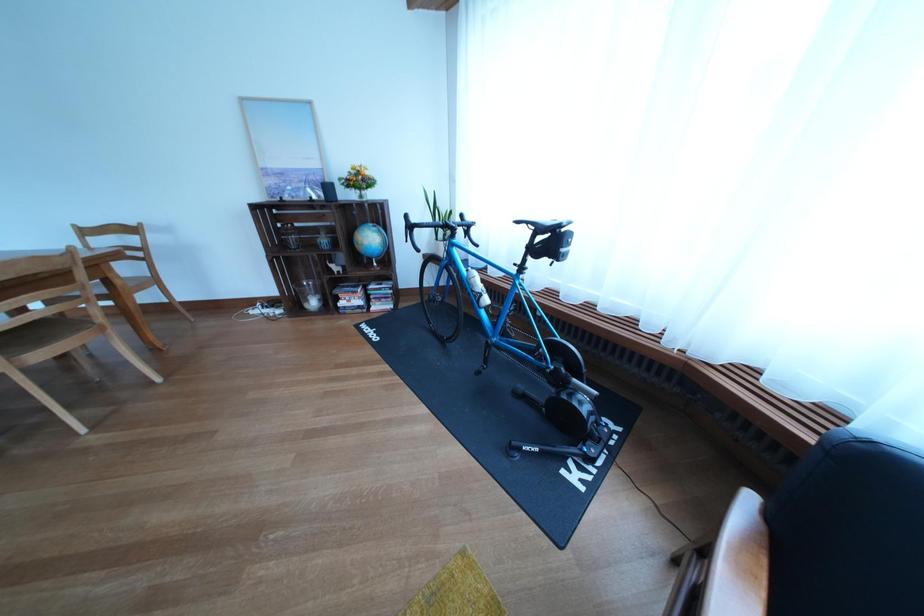
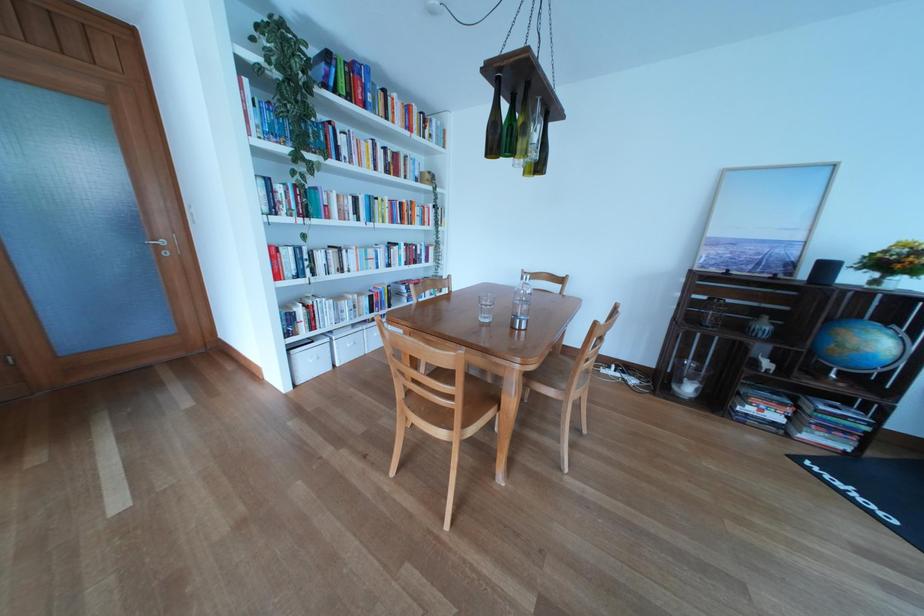
The point at (355, 310) is marked in the first image. Where is the corresponding point in the second image?

(762, 416)